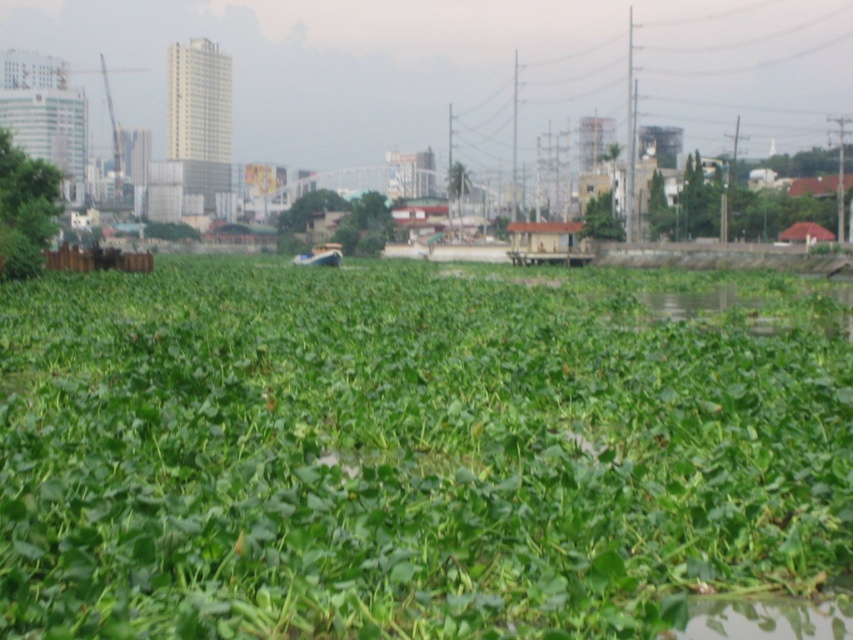
Looking at this image, is green leafy plants at center above green leafy plant at left?

No.

Is green leafy plants at center positioned before green leafy plant at left?

Yes.

What do you see at coordinates (402, 456) in the screenshot?
I see `green leafy plants at center` at bounding box center [402, 456].

Locate an element on the screen. This screenshot has width=853, height=640. green leafy plants at center is located at coordinates (402, 456).